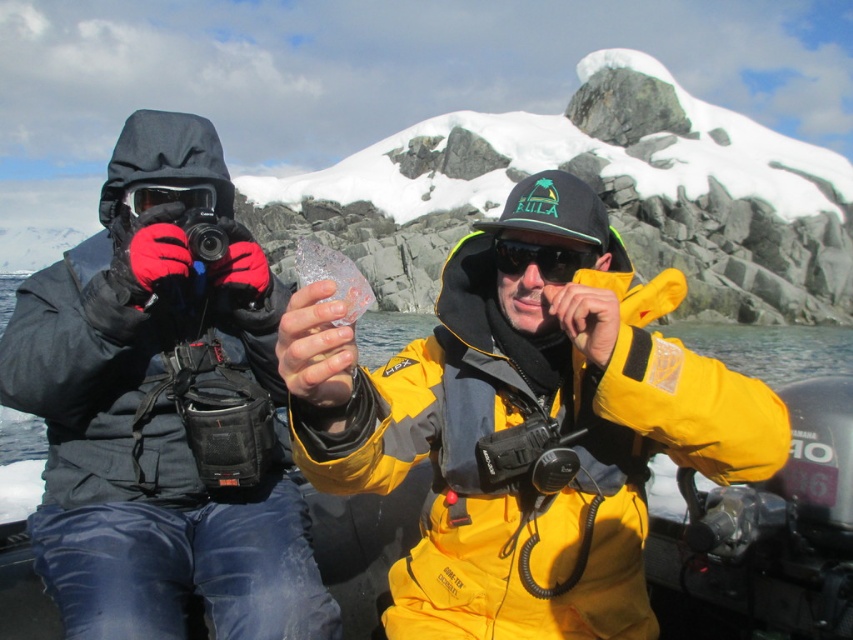
Question: In this image, where is matte black jacket at left located relative to matte black goggles at left?

Choices:
 (A) above
 (B) below

Answer: (B)

Question: Considering the relative positions of matte black jacket at left and matte black goggles at left in the image provided, where is matte black jacket at left located with respect to matte black goggles at left?

Choices:
 (A) above
 (B) below

Answer: (B)

Question: Which object appears farthest from the camera in this image?

Choices:
 (A) black matte sunglasses at center
 (B) matte black jacket at left
 (C) matte black goggles at left

Answer: (C)

Question: Which object appears farthest from the camera in this image?

Choices:
 (A) matte black jacket at left
 (B) matte black goggles at left

Answer: (B)

Question: Which point is farther to the camera?

Choices:
 (A) matte black jacket at left
 (B) matte black goggles at left

Answer: (B)

Question: Is black matte sunglasses at center wider than matte black goggles at left?

Choices:
 (A) no
 (B) yes

Answer: (A)